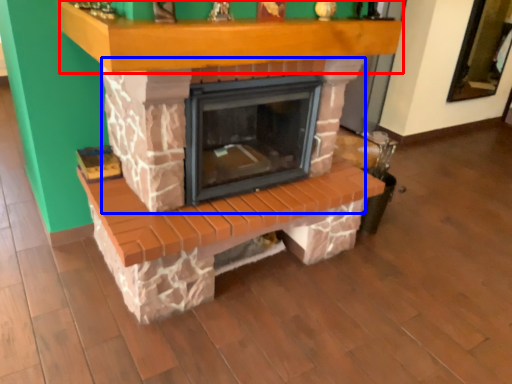
Question: Which of the following is the closest to the observer, mantle (highlighted by a red box) or fireplace (highlighted by a blue box)?

Choices:
 (A) mantle
 (B) fireplace

Answer: (A)